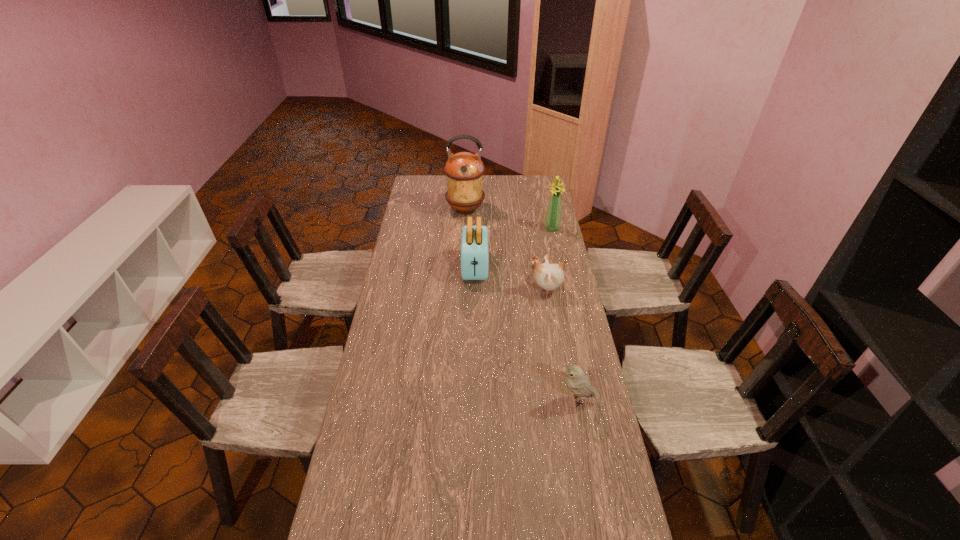
Find the location of a particular element. This screenshot has width=960, height=540. vacant space situated 0.250m at the beak of the farther bird is located at coordinates (467, 291).

Where is `free space located 0.160m at the beak of the farther bird`? This screenshot has width=960, height=540. free space located 0.160m at the beak of the farther bird is located at coordinates (489, 291).

Find the location of a particular element. vacant area located 0.100m at the face of the nearest object is located at coordinates click(522, 400).

Locate an element on the screen. Image resolution: width=960 pixels, height=540 pixels. free space located 0.310m at the face of the nearest object is located at coordinates (458, 400).

Where is `vacant space located at the face of the nearest object`? vacant space located at the face of the nearest object is located at coordinates (511, 400).

Image resolution: width=960 pixels, height=540 pixels. I want to click on bouquet positioned at the right edge, so pyautogui.click(x=552, y=223).

This screenshot has width=960, height=540. What are the coordinates of `free space at the left edge of the desktop` in the screenshot? It's located at (400, 272).

What are the coordinates of `free spot at the right edge of the desktop` in the screenshot? It's located at (573, 323).

In order to click on free space at the far left corner of the desktop in this screenshot , I will do `click(420, 176)`.

Where is `vacant space at the far right corner of the desktop`? This screenshot has width=960, height=540. vacant space at the far right corner of the desktop is located at coordinates point(528,193).